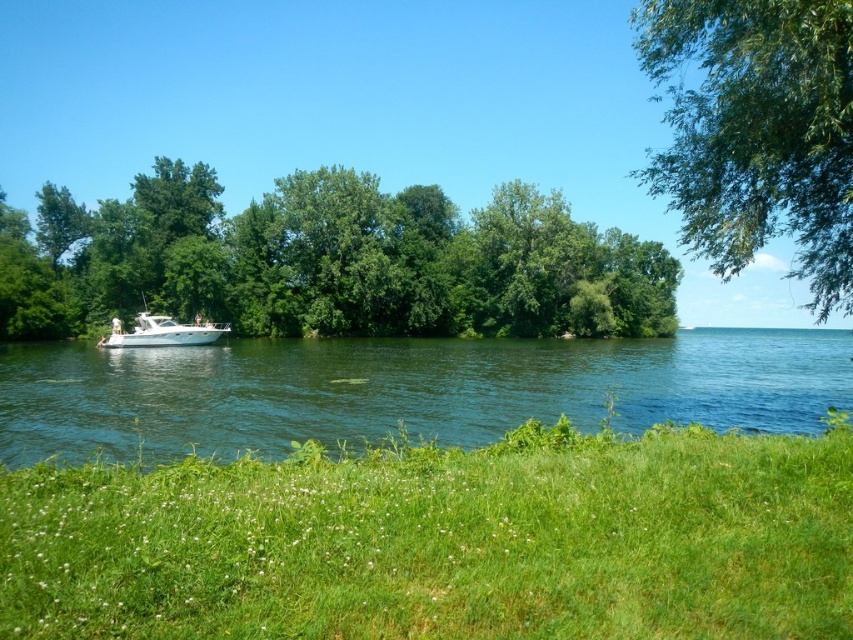
You are standing at the lakeside looking at the scene. There are two points marked in the image. The first point is at coordinate point (x=15, y=612) and the second point is at coordinate point (x=809, y=150). Which of these two points is closer to you?

Point (x=15, y=612) is closer to you than point (x=809, y=150).

Consider the image. You are standing at the edge of the lake and want to place a floating dock exactly at the coordinates mentioned in the scene description. Where should you position it relative to the green water at lower center?

The floating dock should be positioned at the coordinates specified for the green water at lower center, which is at point [405,390].

You are standing at the lakeside and want to take a photo of both the green grass at lower center and the green leafy tree at upper right. Which object should you adjust your camera to focus on first to ensure both are in the frame?

You should focus on the green leafy tree at upper right first because the green grass at lower center is positioned on the left side of it, so adjusting the camera to include the tree will naturally include the grass as well.